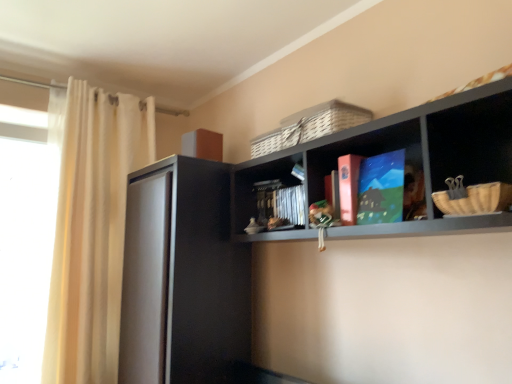
Measure the distance between woven straw basket at right, which is the first basket from bottom to top, and camera.

They are 39.32 inches apart.

This screenshot has width=512, height=384. In order to click on woven straw basket at right, the second basket positioned from the top in this screenshot , I will do `click(476, 200)`.

This screenshot has height=384, width=512. What do you see at coordinates (89, 234) in the screenshot?
I see `white sheer curtain at left` at bounding box center [89, 234].

This screenshot has height=384, width=512. What do you see at coordinates (280, 202) in the screenshot? I see `matte black book at center, arranged as the first book when viewed from the back` at bounding box center [280, 202].

How much space does woven wicker basket at upper center, the second basket when ordered from bottom to top, occupy vertically?

woven wicker basket at upper center, the second basket when ordered from bottom to top, is 5.75 inches in height.

The height and width of the screenshot is (384, 512). Describe the element at coordinates (407, 158) in the screenshot. I see `matte black shelf at upper center` at that location.

At what (x,y) coordinates should I click in order to perform the action: click on woven straw basket at right, which is the 1th basket from front to back. Please return your answer as a coordinate pair (x, y). This screenshot has width=512, height=384. Looking at the image, I should click on (476, 200).

Is matte black book at center, which ranks as the third book in front-to-back order, further to camera compared to matte black shelf at upper center?

Yes, matte black book at center, which ranks as the third book in front-to-back order, is further from the viewer.

What's the angular difference between matte black book at center, arranged as the first book when viewed from the back, and matte black shelf at upper center's facing directions?

The angle between the facing direction of matte black book at center, arranged as the first book when viewed from the back, and the facing direction of matte black shelf at upper center is 1.49 degrees.

Which of these two, matte black book at center, arranged as the first book when viewed from the back, or matte black shelf at upper center, is bigger?

With larger size is matte black shelf at upper center.

Does matte black book at center, arranged as the first book when viewed from the back, have a lesser width compared to matte black shelf at upper center?

Yes.

Is matte black book at center, which ranks as the third book in front-to-back order, further to the viewer compared to white sheer curtain at left?

That is False.

Does matte black book at center, arranged as the first book when viewed from the back, have a lesser width compared to white sheer curtain at left?

Yes, matte black book at center, arranged as the first book when viewed from the back, is thinner than white sheer curtain at left.

Does matte black book at center, which ranks as the third book in front-to-back order, have a smaller size compared to white sheer curtain at left?

Yes.

Is matte black book at center, arranged as the first book when viewed from the back, to the left or to the right of white sheer curtain at left in the image?

matte black book at center, arranged as the first book when viewed from the back, is to the right of white sheer curtain at left.

Which of these two, woven wicker basket at upper center, the second basket when ordered from bottom to top, or white sheer curtain at left, stands taller?

With more height is white sheer curtain at left.

Are woven wicker basket at upper center, which is the 2th basket in right-to-left order, and white sheer curtain at left making contact?

There is a gap between woven wicker basket at upper center, which is the 2th basket in right-to-left order, and white sheer curtain at left.

From the picture: From the image's perspective, which one is positioned higher, woven wicker basket at upper center, which ranks as the 1th basket in back-to-front order, or white sheer curtain at left?

From the image's view, woven wicker basket at upper center, which ranks as the 1th basket in back-to-front order, is above.

Locate an element on the screen. curtain that appears behind the woven wicker basket at upper center, placed as the second basket when sorted from front to back is located at coordinates (89, 234).

Who is taller, matte cardboard book at center, placed as the 2th book when sorted from back to front, or transparent glass window at left?

With more height is transparent glass window at left.

Which object is further away from the camera taking this photo, matte cardboard book at center, placed as the 2th book when sorted from back to front, or transparent glass window at left?

transparent glass window at left is further from the camera.

Is matte cardboard book at center, the second book in the front-to-back sequence, turned away from transparent glass window at left?

No, matte cardboard book at center, the second book in the front-to-back sequence, is not facing away from transparent glass window at left.

Consider the image. Who is more distant, matte black shelf at upper center or matte cardboard book at center, placed as the 2th book when sorted from back to front?

matte cardboard book at center, placed as the 2th book when sorted from back to front, is more distant.

From a real-world perspective, who is located lower, matte black shelf at upper center or matte cardboard book at center, placed as the 2th book when sorted from back to front?

From a 3D spatial view, matte cardboard book at center, placed as the 2th book when sorted from back to front, is below.

Between matte black shelf at upper center and matte cardboard book at center, the second book in the front-to-back sequence, which one appears on the left side from the viewer's perspective?

Positioned to the left is matte cardboard book at center, the second book in the front-to-back sequence.

Which of these two, matte black shelf at upper center or matte cardboard book at center, the second book in the front-to-back sequence, is wider?

matte black shelf at upper center.

From the picture: Is matte black shelf at upper center looking in the opposite direction of transparent glass window at left?

No, matte black shelf at upper center's orientation is not away from transparent glass window at left.

In terms of size, does matte black shelf at upper center appear bigger or smaller than transparent glass window at left?

Considering their sizes, matte black shelf at upper center takes up more space than transparent glass window at left.

Does matte black shelf at upper center have a greater height compared to transparent glass window at left?

Incorrect, the height of matte black shelf at upper center is not larger of that of transparent glass window at left.

Locate an element on the screen. Image resolution: width=512 pixels, height=384 pixels. shelf located on the right of transparent glass window at left is located at coordinates (407, 158).

Identify the location of shelf that is on the right side of matte black book at center, arranged as the first book when viewed from the back. (407, 158).

Is matte black shelf at upper center not near matte black book at center, arranged as the first book when viewed from the back?

That's not correct — matte black shelf at upper center is a little close to matte black book at center, arranged as the first book when viewed from the back.

Considering the sizes of objects matte black shelf at upper center and matte black book at center, arranged as the first book when viewed from the back, in the image provided, who is shorter, matte black shelf at upper center or matte black book at center, arranged as the first book when viewed from the back,?

Standing shorter between the two is matte black book at center, arranged as the first book when viewed from the back.

Considering the positions of objects matte black shelf at upper center and matte black book at center, which ranks as the third book in front-to-back order, in the image provided, who is in front, matte black shelf at upper center or matte black book at center, which ranks as the third book in front-to-back order,?

matte black shelf at upper center is more forward.

What are the coordinates of `shelf above the matte black book at center, arranged as the first book when viewed from the back (from a real-world perspective)` in the screenshot? It's located at (407, 158).

You are a GUI agent. You are given a task and a screenshot of the screen. Output one action in this format:
    pyautogui.click(x=<x>, y=<y>)
    Task: Click on the curtain below the matte black book at center, which ranks as the third book in front-to-back order (from the image's perspective)
    The image size is (512, 384).
    Given the screenshot: What is the action you would take?
    pyautogui.click(x=89, y=234)

Which object lies further to the anchor point matte black shelf at upper center, woven straw basket at right, the second basket positioned from the top, or matte blue book at center, marked as the 1th book in a front-to-back arrangement?

Among the two, woven straw basket at right, the second basket positioned from the top, is located further to matte black shelf at upper center.

Looking at the image, which one is located further to transparent glass window at left, black matte cabinet at left or matte blue book at center, which is the third book from back to front?

matte blue book at center, which is the third book from back to front, is further to transparent glass window at left.

Estimate the real-world distances between objects in this image. Which object is further from matte cardboard book at center, placed as the 2th book when sorted from back to front, woven wicker basket at upper center, which ranks as the 1th basket in back-to-front order, or matte black shelf at upper center?

matte black shelf at upper center lies further to matte cardboard book at center, placed as the 2th book when sorted from back to front, than the other object.

Looking at the image, which one is located closer to transparent glass window at left, black matte cabinet at left or woven straw basket at right, which is the 1th basket from front to back?

Among the two, black matte cabinet at left is located nearer to transparent glass window at left.

Estimate the real-world distances between objects in this image. Which object is closer to matte cardboard book at center, the second book in the front-to-back sequence, matte blue book at center, which is the third book from back to front, or woven straw basket at right, arranged as the second basket when viewed from the left?

matte blue book at center, which is the third book from back to front.

Estimate the real-world distances between objects in this image. Which object is further from black matte cabinet at left, matte black book at center, arranged as the first book when viewed from the back, or matte cardboard book at center, placed as the 2th book when sorted from back to front?

matte cardboard book at center, placed as the 2th book when sorted from back to front, is further to black matte cabinet at left.

Estimate the real-world distances between objects in this image. Which object is further from matte black shelf at upper center, woven wicker basket at upper center, which ranks as the 1th basket in back-to-front order, or matte blue book at center, which is the third book from back to front?

woven wicker basket at upper center, which ranks as the 1th basket in back-to-front order.

Looking at the image, which one is located further to transparent glass window at left, matte black shelf at upper center or matte black book at center, which ranks as the third book in front-to-back order?

matte black shelf at upper center.

Image resolution: width=512 pixels, height=384 pixels. I want to click on basket located between matte black shelf at upper center and matte blue book at center, marked as the 1th book in a front-to-back arrangement, in the depth direction, so click(x=476, y=200).

Image resolution: width=512 pixels, height=384 pixels. In order to click on screen door between white sheer curtain at left and woven wicker basket at upper center, placed as the second basket when sorted from front to back, from left to right in this screenshot , I will do `click(182, 277)`.

In order to click on basket located between white sheer curtain at left and matte black shelf at upper center in the left-right direction in this screenshot , I will do `click(310, 126)`.

Identify the location of screen door located between white sheer curtain at left and matte cardboard book at center, the second book in the front-to-back sequence, in the left-right direction. The width and height of the screenshot is (512, 384). (182, 277).